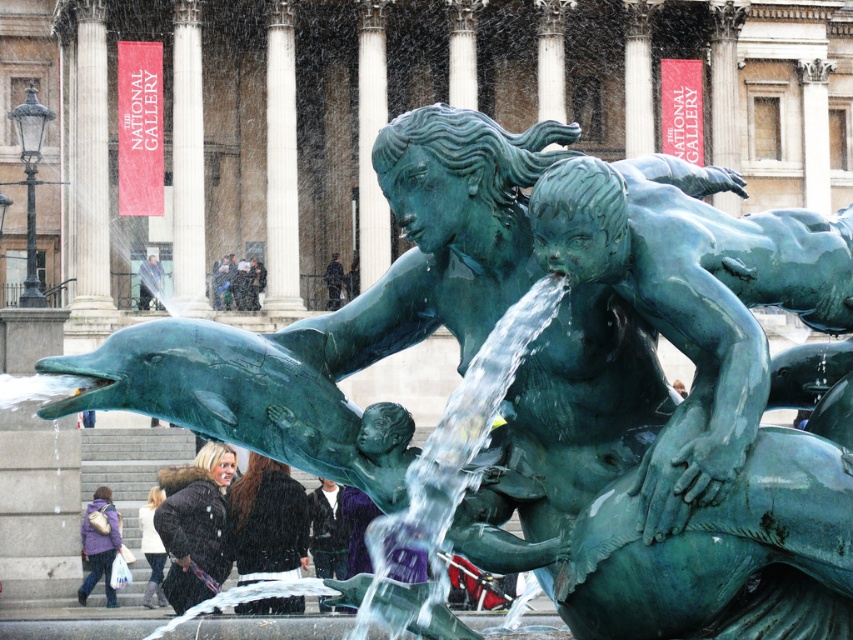
Question: Which point is closer to the camera?

Choices:
 (A) black leather jacket at lower center
 (B) purple fabric jacket at lower left
 (C) green marble pillar at center

Answer: (A)

Question: Among these points, which one is farthest from the camera?

Choices:
 (A) (117, 525)
 (B) (271, 188)
 (C) (202, 593)
 (D) (367, 129)

Answer: (D)

Question: Does white marble pillar at center have a larger size compared to purple fabric jacket at lower left?

Choices:
 (A) no
 (B) yes

Answer: (B)

Question: Is white marble pillar at center closer to the viewer compared to dark brown fur coat at lower left?

Choices:
 (A) yes
 (B) no

Answer: (B)

Question: Considering the real-world distances, which object is closest to the white marble pillar at center?

Choices:
 (A) black leather jacket at lower center
 (B) smooth skin person at lower left

Answer: (B)

Question: Is green marble pillar at center to the right of dark brown leather jacket at center from the viewer's perspective?

Choices:
 (A) yes
 (B) no

Answer: (A)